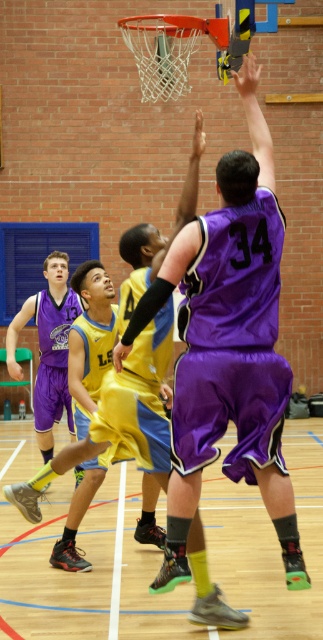
You are a basketball player standing at the point marked as point (52, 356). You want to pass the ball to your teammate who is 3 meters away from you in the direction facing the blue window frame. Is your teammate within the gymnasium?

The distance between point (52, 356) and the viewer is 9.34 meters. Since your teammate is only 3 meters away from you, they are still within the gymnasium.

You are a referee standing at the edge of the court. You need to quickly assess whether the distance between the purple fabric shorts at center and the purple satin jersey at center is within the 3 meters rule for offside calls. Is the distance compliant?

The distance between the purple fabric shorts at center and the purple satin jersey at center is 3.79 meters, which exceeds the 3 meters rule. Therefore, the offside rule would be violated.

You are a referee standing at the baseline of the gymnasium. You need to determine if the two players wearing purple shorts are within the 15 feet distance rule for a legal play. Can you confirm if the distance between the purple fabric shorts at center and the matte purple shorts at left is under 15 feet?

The distance between the purple fabric shorts at center and the matte purple shorts at left is 12.39 feet, which is under the 15 feet requirement. Therefore, the players are within the legal distance for the play.